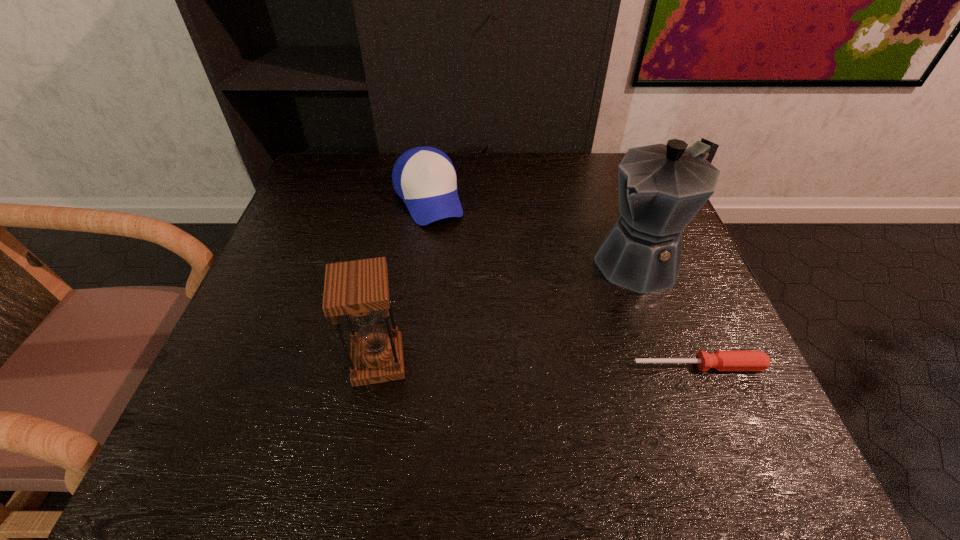
Where is `vacant spot on the desktop that is between the second tallest object and the screwdriver and is positioned on the front-facing side of the farthest object`? This screenshot has height=540, width=960. vacant spot on the desktop that is between the second tallest object and the screwdriver and is positioned on the front-facing side of the farthest object is located at coordinates coord(493,363).

Find the location of a particular element. vacant space on the desktop that is between the hourglass and the shortest object and is positioned at the spout of the tallest object is located at coordinates (497, 363).